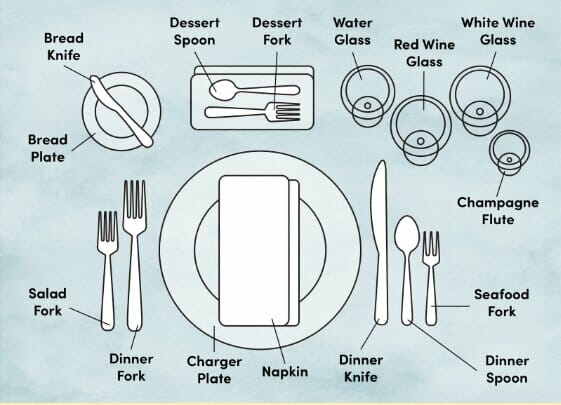
Locate an element on the screen. The height and width of the screenshot is (405, 561). glass is located at coordinates (369, 101), (413, 136), (488, 108), (512, 158).